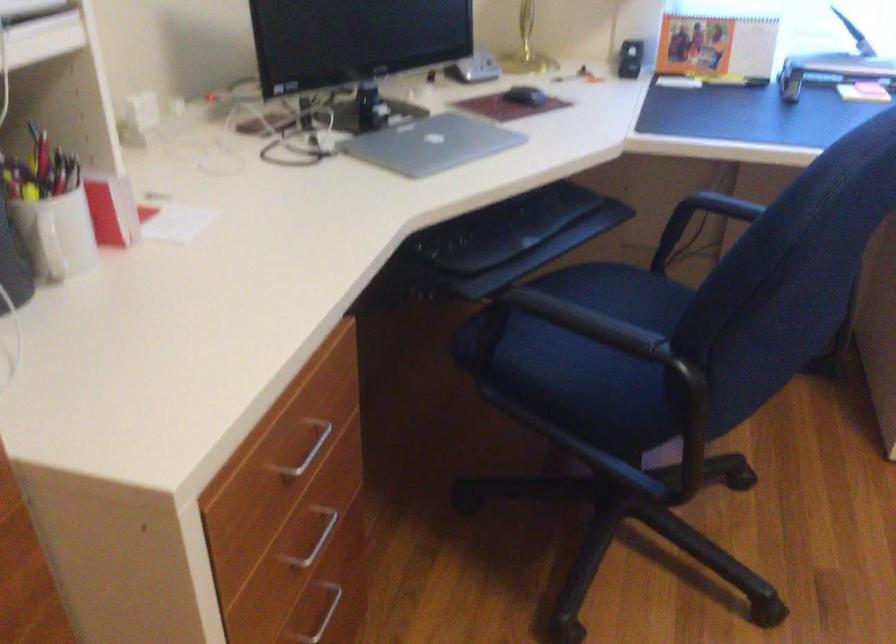
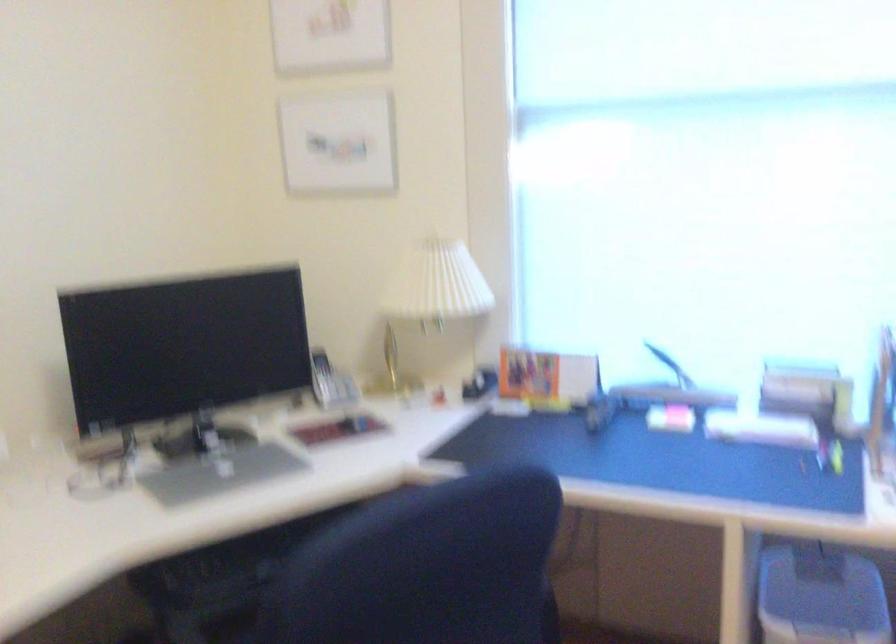
Question: Based on the continuous images, in which direction is the camera rotating? Reply with the corresponding letter.

Choices:
 (A) Left
 (B) Right
 (C) Up
 (D) Down

Answer: (C)